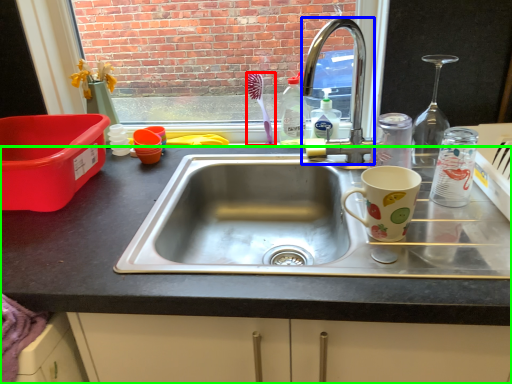
Question: Which object is positioned farthest from toothbrush (highlighted by a red box)? Select from faucet (highlighted by a blue box) and desk (highlighted by a green box).

Choices:
 (A) faucet
 (B) desk

Answer: (B)